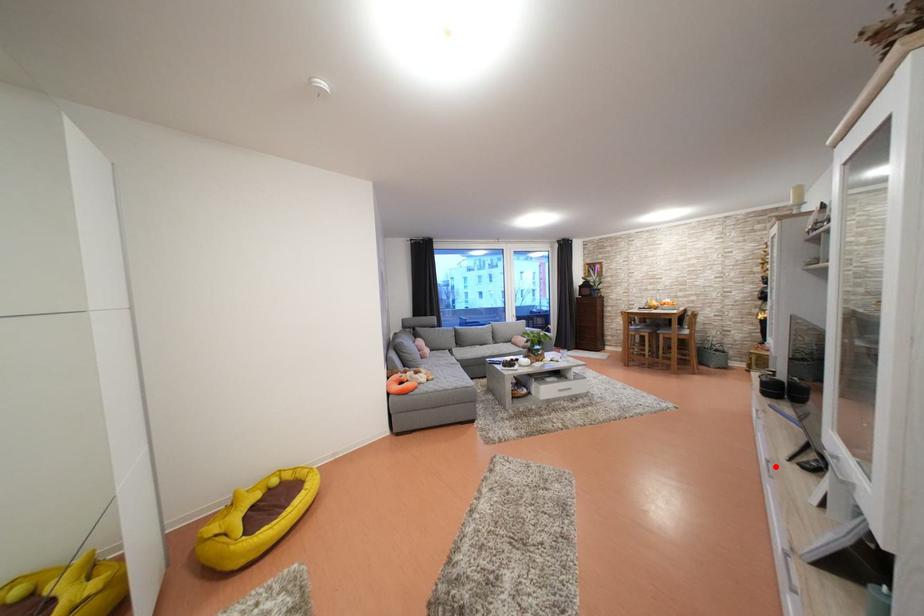
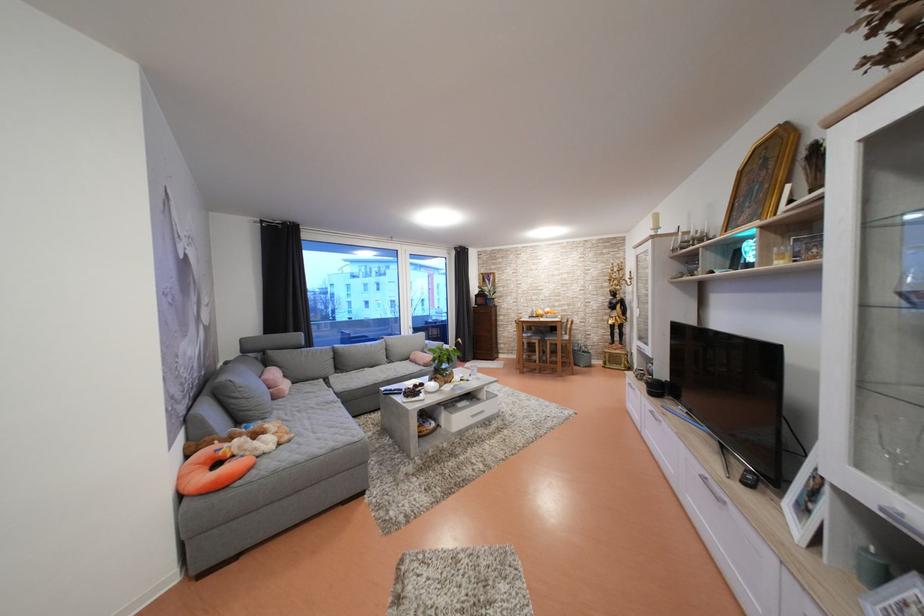
Question: I am providing you with two images of the same scene from different viewpoints. A red point is shown in image1. For the corresponding object point in image2, is it positioned nearer or farther from the camera?

Choices:
 (A) Nearer
 (B) Farther

Answer: (A)